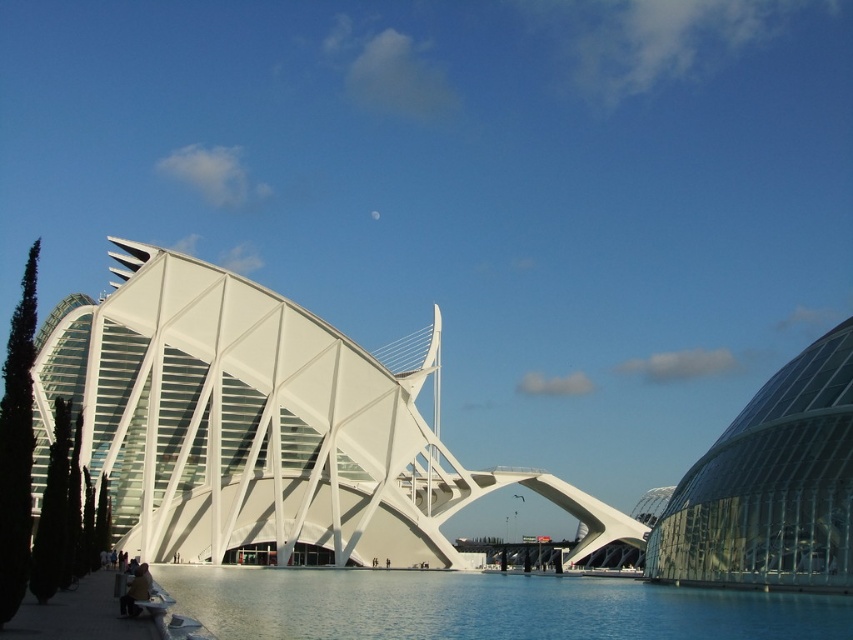
Does transparent blue water at center lie behind transparent glass dome at right?

That is False.

Who is shorter, transparent blue water at center or transparent glass dome at right?

transparent blue water at center

Between point (834, 600) and point (679, 554), which one is positioned in front?

Point (834, 600)

The width and height of the screenshot is (853, 640). I want to click on transparent blue water at center, so click(485, 605).

Between white glass bridge at center and transparent glass dome at right, which one is positioned lower?

transparent glass dome at right is below.

Is white glass bridge at center positioned behind transparent glass dome at right?

Yes, it is.

Describe the element at coordinates (260, 426) in the screenshot. I see `white glass bridge at center` at that location.

Identify the location of white glass bridge at center. (260, 426).

Who is positioned more to the left, white glass bridge at center or transparent blue water at center?

white glass bridge at center is more to the left.

Who is shorter, white glass bridge at center or transparent blue water at center?

Standing shorter between the two is transparent blue water at center.

The width and height of the screenshot is (853, 640). What do you see at coordinates (260, 426) in the screenshot?
I see `white glass bridge at center` at bounding box center [260, 426].

You are a GUI agent. You are given a task and a screenshot of the screen. Output one action in this format:
    pyautogui.click(x=<x>, y=<y>)
    Task: Click on the white glass bridge at center
    Image resolution: width=853 pixels, height=640 pixels.
    Given the screenshot: What is the action you would take?
    pyautogui.click(x=260, y=426)